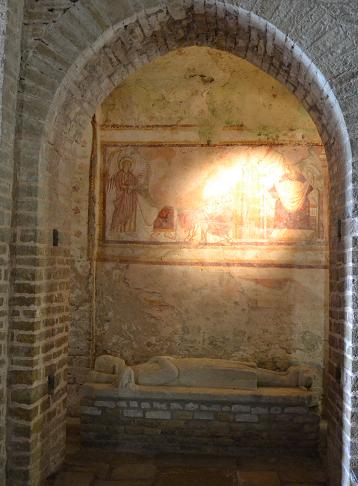
Identify the location of floor. This screenshot has height=486, width=358. (123, 476).